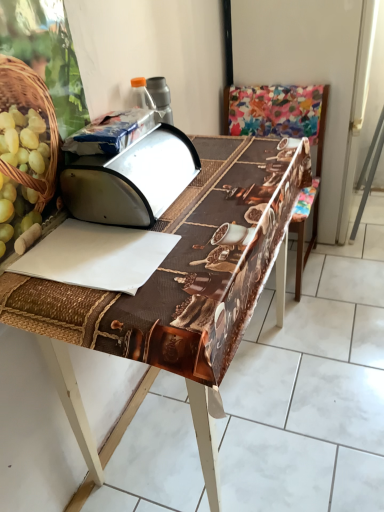
Where is `empty space that is in between multicolored fabric chair at center and brown woven table at center`? The width and height of the screenshot is (384, 512). empty space that is in between multicolored fabric chair at center and brown woven table at center is located at coordinates (307, 284).